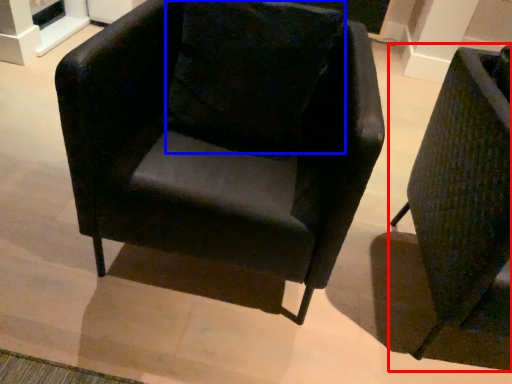
Question: Which object is closer to the camera taking this photo, chair (highlighted by a red box) or pillow (highlighted by a blue box)?

Choices:
 (A) chair
 (B) pillow

Answer: (A)